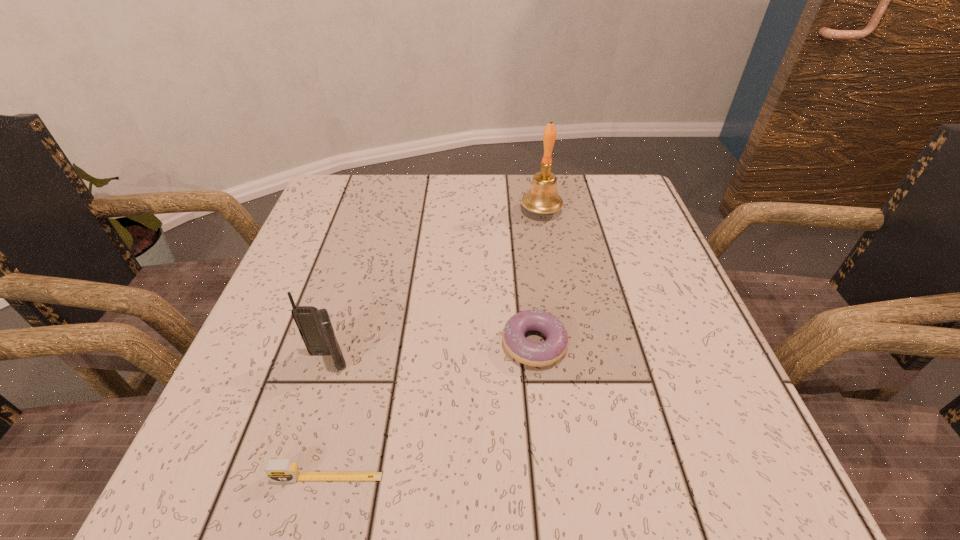
The height and width of the screenshot is (540, 960). Identify the location of vacant area that lies between the cellular telephone and the doughnut. (431, 353).

Find the location of a particular element. The width and height of the screenshot is (960, 540). free spot between the tallest object and the cellular telephone is located at coordinates (435, 286).

At what (x,y) coordinates should I click in order to perform the action: click on free spot between the doughnut and the cellular telephone. Please return your answer as a coordinate pair (x, y). This screenshot has width=960, height=540. Looking at the image, I should click on (431, 353).

Identify the location of free area in between the doughnut and the nearest object. (431, 410).

The width and height of the screenshot is (960, 540). I want to click on free space that is in between the doughnut and the farthest object, so click(538, 278).

I want to click on blank region between the tape measure and the third shortest object, so coord(327,420).

Locate an element on the screen. This screenshot has height=540, width=960. free space between the bell and the cellular telephone is located at coordinates (435, 286).

Image resolution: width=960 pixels, height=540 pixels. Identify the location of vacant space that is in between the tallest object and the nearest object. (434, 344).

This screenshot has height=540, width=960. Find the location of `vacant space that's between the cellular telephone and the doughnut`. vacant space that's between the cellular telephone and the doughnut is located at coordinates (431, 353).

Locate an element on the screen. object identified as the second closest to the doughnut is located at coordinates (315, 327).